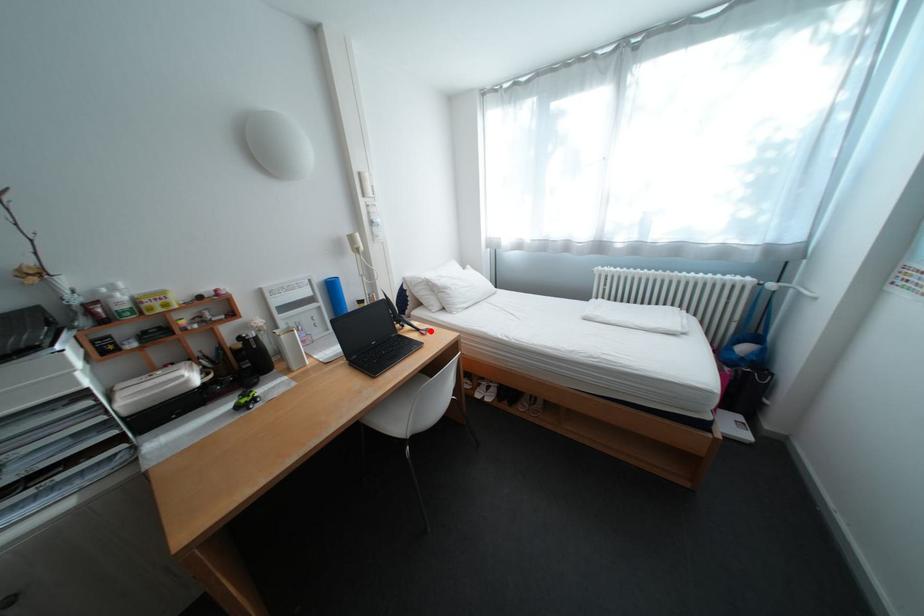
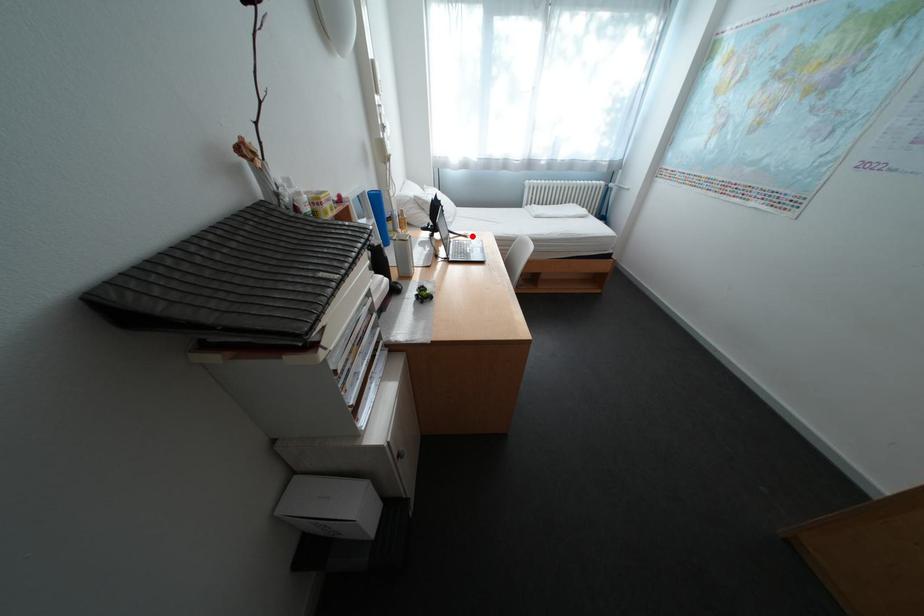
I am providing you with two images of the same scene from different viewpoints. A red point is marked on the first image and another point is marked on the second image. Do the highlighted points in image1 and image2 indicate the same real-world spot?

Yes